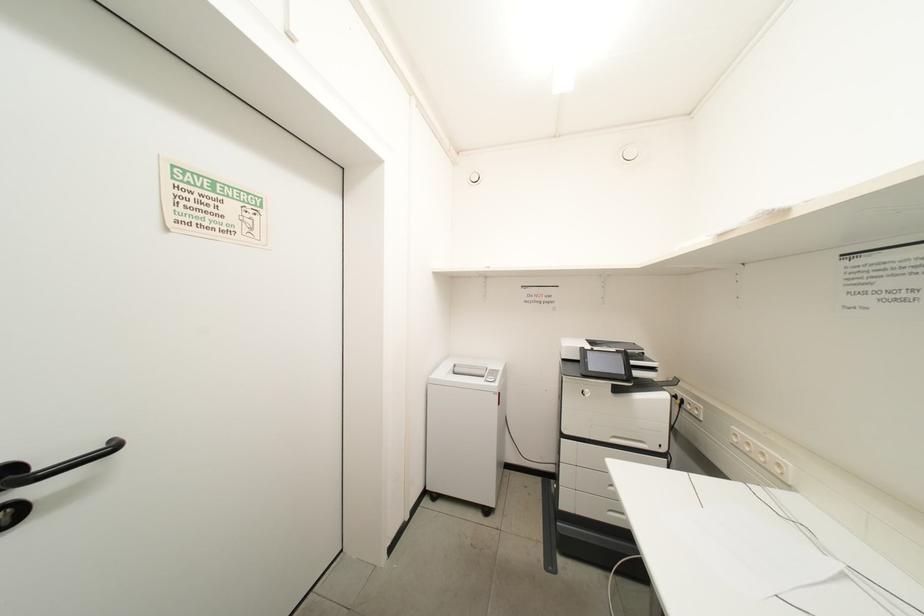
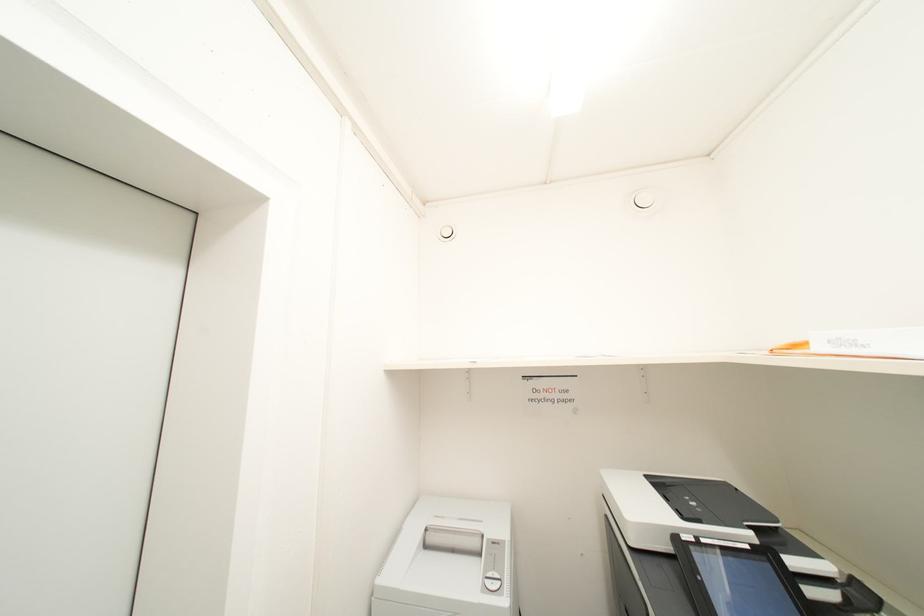
Question: What movement of the cameraman would produce the second image?

Choices:
 (A) Left
 (B) Right
 (C) Forward
 (D) Backward

Answer: (C)